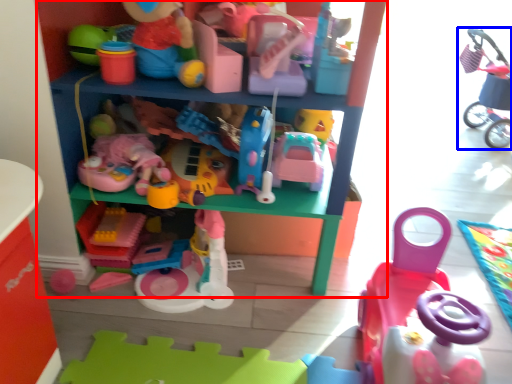
Question: Among these objects, which one is farthest to the camera, shelf (highlighted by a red box) or toy (highlighted by a blue box)?

Choices:
 (A) shelf
 (B) toy

Answer: (B)